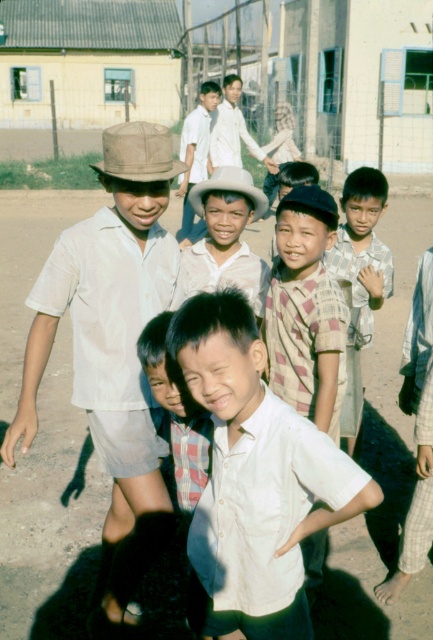
From the picture: You are a photographer trying to capture a photo of the brown dirt field at center and the plaid cotton shirt at center. Based on their positions, which object would appear closer to the camera in the final photo?

The plaid cotton shirt at center would appear closer to the camera because the brown dirt field at center is positioned above it, indicating the shirt is lower in the scene and thus nearer to the photographer.

You are a photographer trying to capture a shot of the matte brown hat at left and the checkered fabric shirt at center. Based on their positions, which object should you focus on first if you want to ensure both are in the frame without moving the camera?

The matte brown hat at left is below the checkered fabric shirt at center, so you should focus on the checkered fabric shirt at center first to ensure both are in the frame without moving the camera.